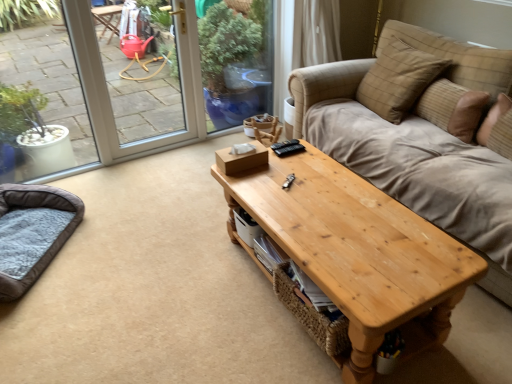
Question: From a real-world perspective, is brown textured pillow at upper right, the first pillow from the right, over plaid fabric pillow at upper right, the second pillow from the right?

Choices:
 (A) yes
 (B) no

Answer: (B)

Question: Is brown textured pillow at upper right, the first pillow from the right, facing away from plaid fabric pillow at upper right, which is the first pillow in left-to-right order?

Choices:
 (A) no
 (B) yes

Answer: (A)

Question: Can you confirm if brown textured pillow at upper right, which is the 2th pillow in left-to-right order, is positioned to the left of plaid fabric pillow at upper right, the second pillow from the right?

Choices:
 (A) no
 (B) yes

Answer: (A)

Question: From the image's perspective, does brown textured pillow at upper right, the first pillow from the right, appear higher than plaid fabric pillow at upper right, which is the first pillow in left-to-right order?

Choices:
 (A) yes
 (B) no

Answer: (B)

Question: From a real-world perspective, is brown textured pillow at upper right, which is the 2th pillow in left-to-right order, beneath plaid fabric pillow at upper right, the second pillow from the right?

Choices:
 (A) yes
 (B) no

Answer: (A)

Question: In the image, is natural wood coffee table at center on the left side or the right side of brown textured pillow at upper right, which is the 2th pillow in left-to-right order?

Choices:
 (A) left
 (B) right

Answer: (A)

Question: Relative to brown textured pillow at upper right, which is the 2th pillow in left-to-right order, is natural wood coffee table at center in front or behind?

Choices:
 (A) front
 (B) behind

Answer: (A)

Question: From the image's perspective, is natural wood coffee table at center above or below brown textured pillow at upper right, which is the 2th pillow in left-to-right order?

Choices:
 (A) below
 (B) above

Answer: (A)

Question: Is natural wood coffee table at center taller or shorter than brown textured pillow at upper right, which is the 2th pillow in left-to-right order?

Choices:
 (A) short
 (B) tall

Answer: (B)

Question: From the image's perspective, relative to dark brown plush cat bed at lower left, is plaid fabric pillow at upper right, the second pillow from the right, above or below?

Choices:
 (A) above
 (B) below

Answer: (A)

Question: From their relative heights in the image, would you say plaid fabric pillow at upper right, the second pillow from the right, is taller or shorter than dark brown plush cat bed at lower left?

Choices:
 (A) tall
 (B) short

Answer: (A)

Question: Based on their sizes in the image, would you say plaid fabric pillow at upper right, the second pillow from the right, is bigger or smaller than dark brown plush cat bed at lower left?

Choices:
 (A) big
 (B) small

Answer: (A)

Question: From a real-world perspective, is plaid fabric pillow at upper right, the second pillow from the right, physically located above or below dark brown plush cat bed at lower left?

Choices:
 (A) below
 (B) above

Answer: (B)

Question: Considering the positions of point (330, 190) and point (40, 238), is point (330, 190) closer or farther from the camera than point (40, 238)?

Choices:
 (A) farther
 (B) closer

Answer: (B)

Question: From the image's perspective, is natural wood coffee table at center located above or below dark brown plush cat bed at lower left?

Choices:
 (A) above
 (B) below

Answer: (B)